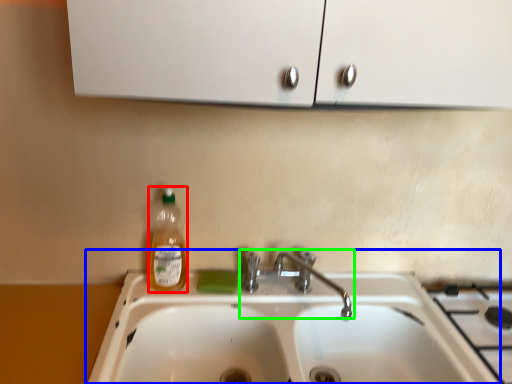
Question: Which object is the farthest from bottle (highlighted by a red box)? Choose among these: sink (highlighted by a blue box) or tap (highlighted by a green box).

Choices:
 (A) sink
 (B) tap

Answer: (A)